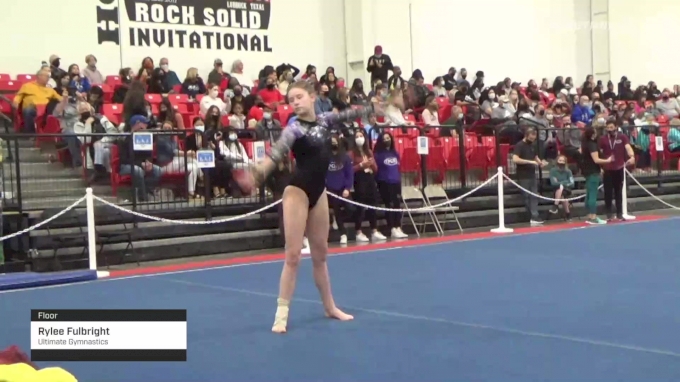
This screenshot has height=382, width=680. I want to click on places to sit, so click(489, 144), click(476, 152), click(443, 145), click(432, 154), click(404, 150).